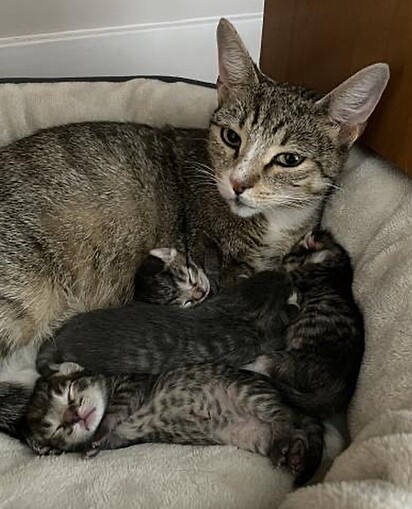
Identify the location of wall. (323, 55), (170, 12).